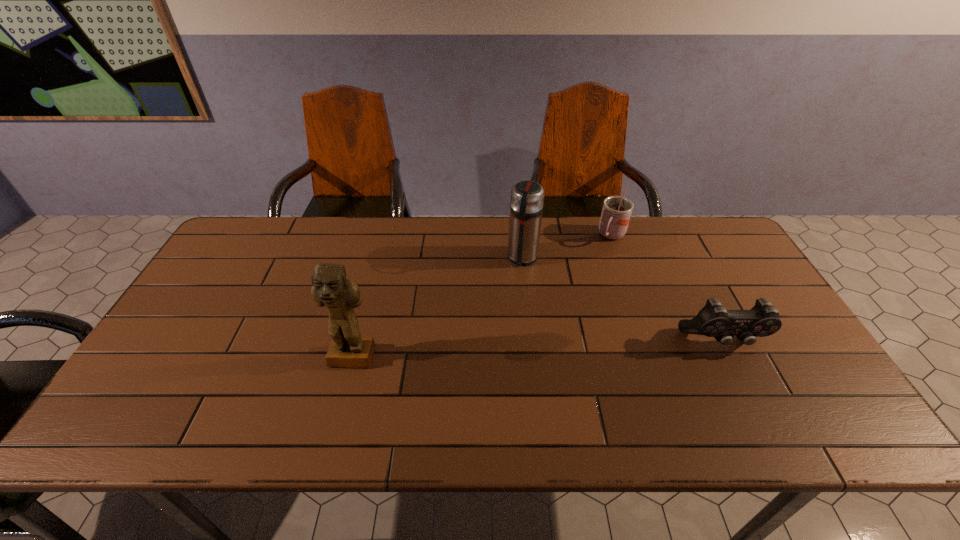
You are a GUI agent. You are given a task and a screenshot of the screen. Output one action in this format:
    pyautogui.click(x=<x>, y=<y>)
    Task: Click on the blank region between the figurine and the third object from left to right
    The image size is (960, 540).
    Given the screenshot: What is the action you would take?
    pyautogui.click(x=482, y=298)

At what (x,y) coordinates should I click in order to perform the action: click on blank region between the figurine and the second object from left to right. Please return your answer as a coordinate pair (x, y). The width and height of the screenshot is (960, 540). Looking at the image, I should click on (438, 308).

Select which object is the closest to the third object from right to left. Please provide its 2D coordinates. Your answer should be formatted as a tuple, i.e. [(x, y)], where the tuple contains the x and y coordinates of a point satisfying the conditions above.

[(616, 212)]

Identify the location of the second closest object to the leftmost object. (616, 212).